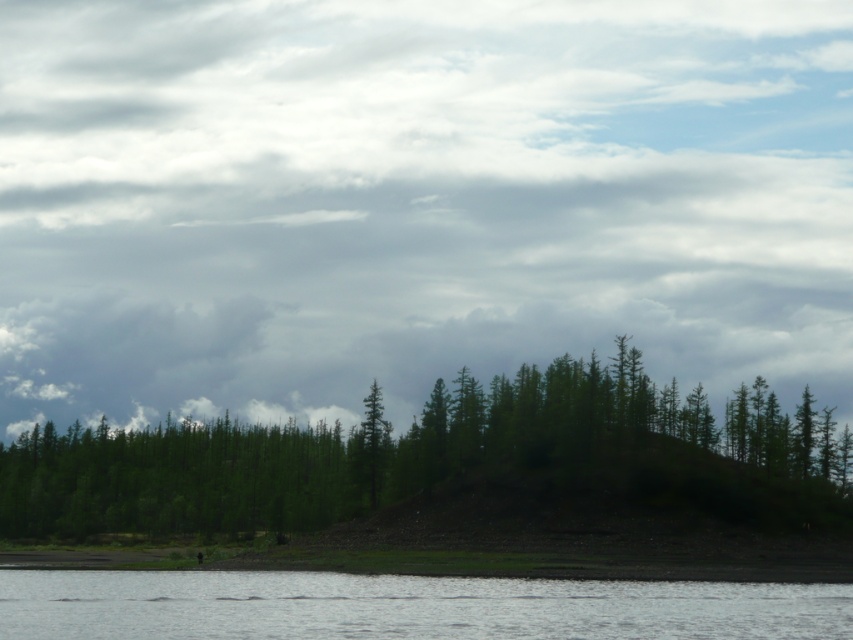
You are standing at the edge of the clear water at lower center. Which direction should you face to see the green matte forest at center?

You should face to the right to see the green matte forest at center because it is located to the left of clear water at lower center from your position.

You are a hiker who wants to take a photo of the cloudy sky at upper center and the green matte tree at center from a distance. How far apart are these two objects in the scene?

The cloudy sky at upper center is 721.33 feet from the green matte tree at center.